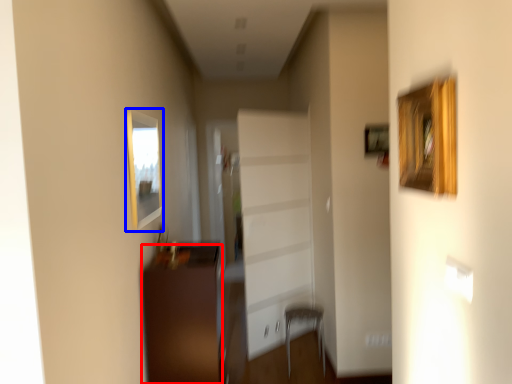
Question: Among these objects, which one is nearest to the camera, furniture (highlighted by a red box) or picture frame (highlighted by a blue box)?

Choices:
 (A) furniture
 (B) picture frame

Answer: (B)